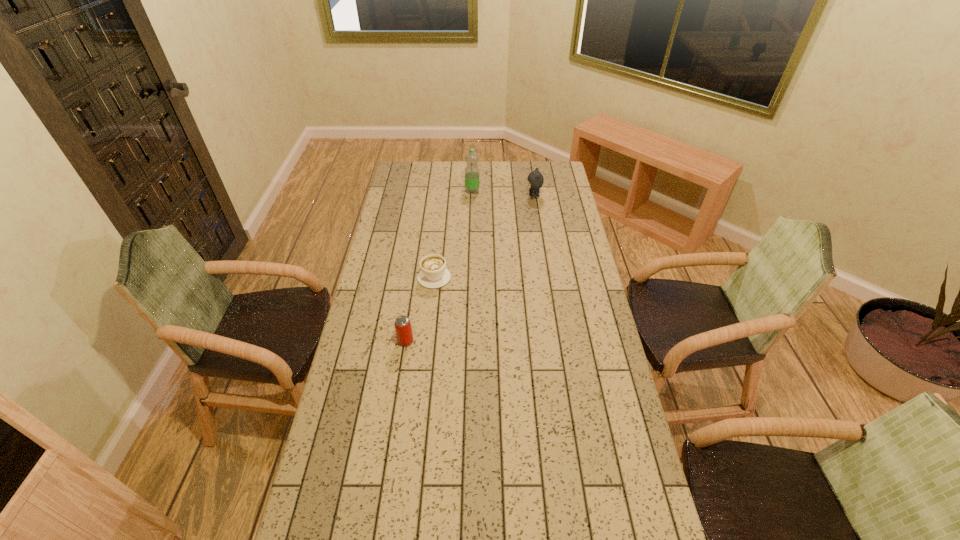
Image resolution: width=960 pixels, height=540 pixels. In the image, there is a desktop. In order to click on free region at the far right corner in this screenshot , I will do `click(558, 163)`.

Where is `free space between the rightmost object and the nearest object`? free space between the rightmost object and the nearest object is located at coordinates (469, 269).

Where is `unoccupied position between the second shortest object and the shortest object`? This screenshot has width=960, height=540. unoccupied position between the second shortest object and the shortest object is located at coordinates (420, 309).

The width and height of the screenshot is (960, 540). What are the coordinates of `free point between the cappuccino and the tallest object` in the screenshot? It's located at (453, 234).

I want to click on vacant region between the second tallest object and the third farthest object, so click(484, 237).

Where is `the second closest object to the nearest object`? The width and height of the screenshot is (960, 540). the second closest object to the nearest object is located at coordinates (471, 157).

Locate an element on the screen. object identified as the second closest to the tallest object is located at coordinates (433, 274).

The height and width of the screenshot is (540, 960). I want to click on vacant region that satisfies the following two spatial constraints: 1. to the right of the water bottle's handle; 2. on the right side of the second nearest object, so click(x=444, y=191).